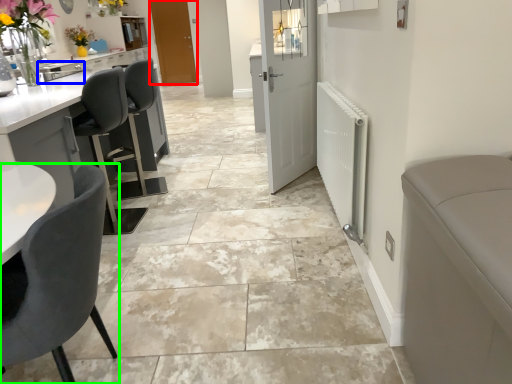
Question: Considering the real-world distances, which object is closest to door (highlighted by a red box)? sink (highlighted by a blue box) or chair (highlighted by a green box).

Choices:
 (A) sink
 (B) chair

Answer: (A)